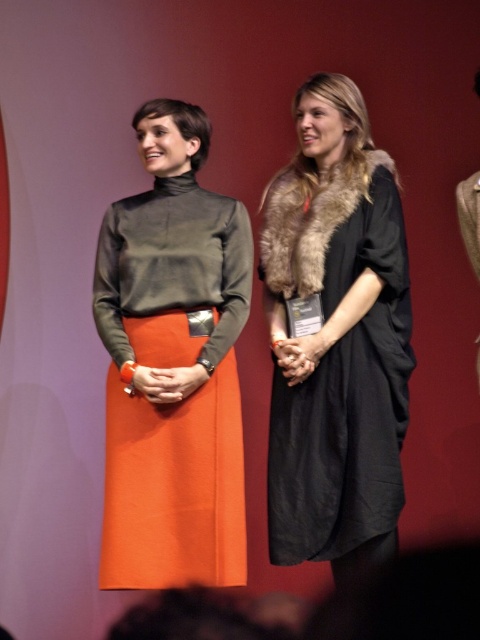
You are a photographer at a formal event. You need to adjust the lighting to ensure both the orange matte skirt at center and the black matte dress at right are well illuminated. Considering their sizes, which one might require more focused lighting adjustments?

The orange matte skirt at center has a larger size compared to the black matte dress at right, so it might require more focused lighting adjustments to ensure proper illumination due to its bigger surface area.

You are a photographer at a formal event. You need to capture a photo of the orange matte skirt at center and the black matte dress at right. Based on their positions, which one should you focus on first if you want to capture them from left to right?

The orange matte skirt at center is to the left of the black matte dress at right, so you should focus on the orange matte skirt at center first to capture them from left to right.

You are a photographer at a formal event. You need to capture a photo where the orange matte skirt at center is visible without being covered by the black matte dress at right. Is this possible based on their positions?

The orange matte skirt at center is located above the black matte dress at right, so yes, the skirt will be visible as it is positioned higher and not obstructed by the dress.